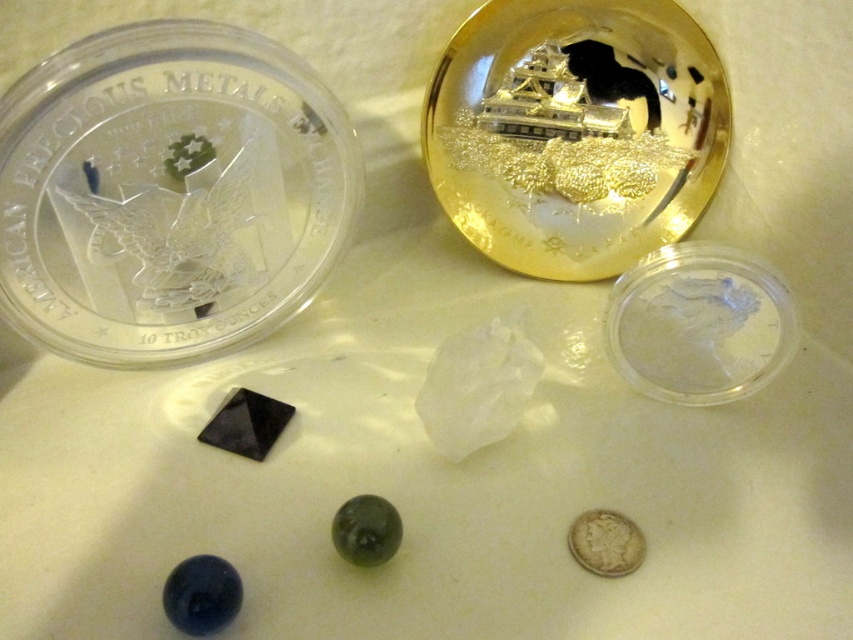
Does gold reflective coin at upper center have a lesser height compared to silver metallic coin at lower right?

No.

The image size is (853, 640). I want to click on gold reflective coin at upper center, so click(575, 131).

Is clear plastic coin at upper left positioned at the back of silver metallic coin at lower right?

No, it is in front of silver metallic coin at lower right.

Who is lower down, clear plastic coin at upper left or silver metallic coin at lower right?

Positioned lower is silver metallic coin at lower right.

You are a GUI agent. You are given a task and a screenshot of the screen. Output one action in this format:
    pyautogui.click(x=<x>, y=<y>)
    Task: Click on the clear plastic coin at upper left
    
    Given the screenshot: What is the action you would take?
    pyautogui.click(x=167, y=193)

Between point (218, 193) and point (474, 104), which one is positioned in front?

Point (218, 193)

Is clear plastic coin at upper left closer to camera compared to gold reflective coin at upper center?

Yes, clear plastic coin at upper left is closer to the viewer.

Is point (51, 296) more distant than point (592, 172)?

No, it is not.

The height and width of the screenshot is (640, 853). Identify the location of clear plastic coin at upper left. (167, 193).